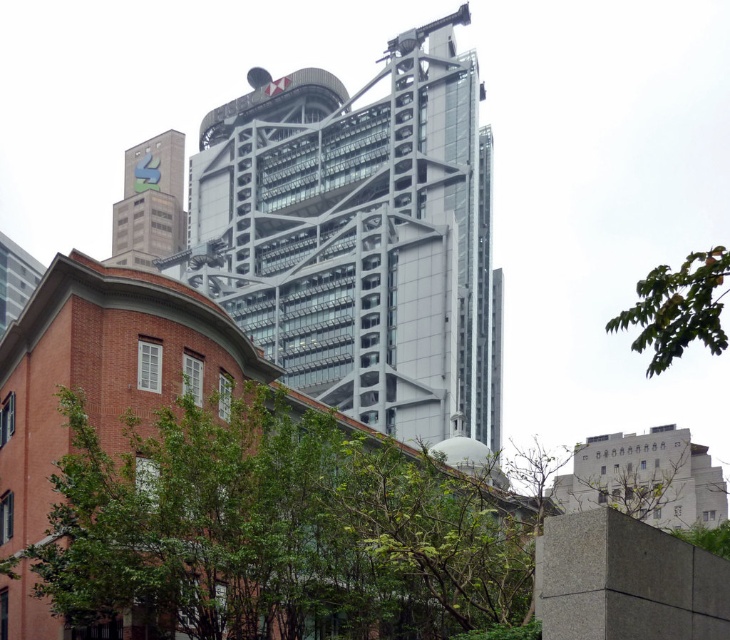
Is green leafy tree at upper right to the right of matte gray building at upper left from the viewer's perspective?

Yes, green leafy tree at upper right is to the right of matte gray building at upper left.

Describe the element at coordinates (677, 308) in the screenshot. I see `green leafy tree at upper right` at that location.

Image resolution: width=730 pixels, height=640 pixels. Identify the location of green leafy tree at upper right. (677, 308).

Is metallic glass tower at upper center wider than matte gray building at upper left?

Yes.

Between metallic glass tower at upper center and matte gray building at upper left, which one has more height?

metallic glass tower at upper center

Is point (472, 244) closer to camera compared to point (139, 166)?

Yes, point (472, 244) is in front of point (139, 166).

At what (x,y) coordinates should I click in order to perform the action: click on metallic glass tower at upper center. Please return your answer as a coordinate pair (x, y). Looking at the image, I should click on (361, 240).

Which is below, green leafy tree at lower left or matte gray building at upper left?

green leafy tree at lower left is below.

Does point (334, 470) lie behind point (172, 131)?

No, (334, 470) is closer to viewer.

The image size is (730, 640). Identify the location of green leafy tree at lower left. (274, 531).